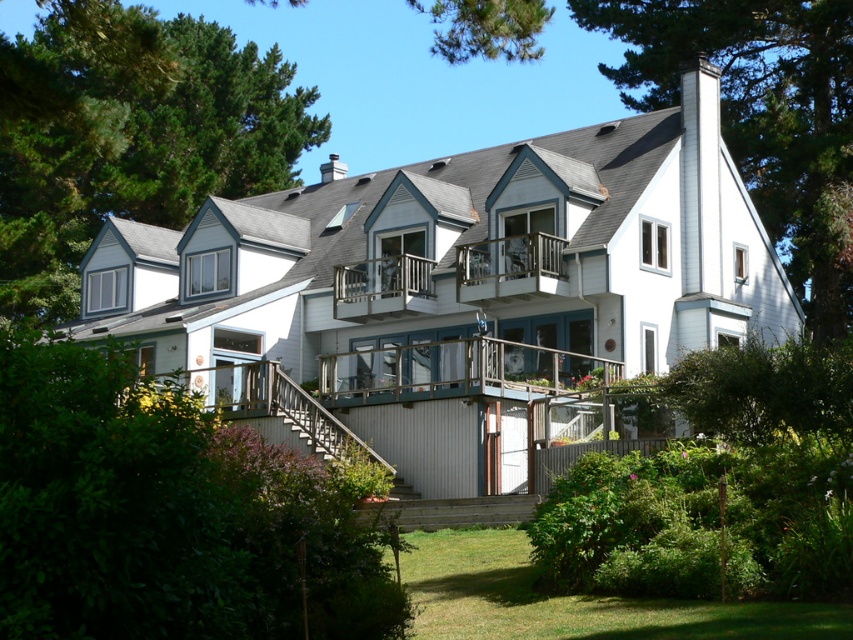
You are standing in front of the two story house and want to plant a new tree in your backyard. The green leafy tree at upper right is already there. Where should you plant the new tree so it doesn not block the view from the upper balcony?

The green leafy tree at upper right is located at point (762, 116). To avoid blocking the view from the upper balcony, plant the new tree in an area away from the upper right position, such as the lower left or middle sections of the backyard.

You are standing in the front yard of the house and want to plant a new tree. The green leafy tree at upper left and the wooden at center are already present. Which existing tree is taller and should be considered for spacing when planting the new tree?

The green leafy tree at upper left is much taller than the wooden at center, so it should be considered for spacing when planting the new tree.

You are standing at the wooden at center of the house. You want to reach the green leafy tree at upper right. The path you need to take is 30 meters long. Will you have to walk more than the path length to reach the tree?

The green leafy tree at upper right is 27.57 meters away from wooden at center, so no, you will not have to walk more than the path length of 30 meters to reach the tree.